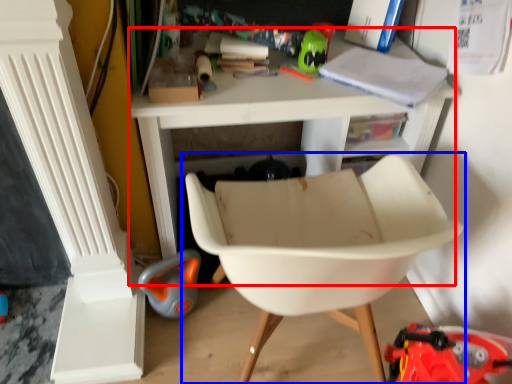
Question: Which object appears closest to the camera in this image, table (highlighted by a red box) or chair (highlighted by a blue box)?

Choices:
 (A) table
 (B) chair

Answer: (B)